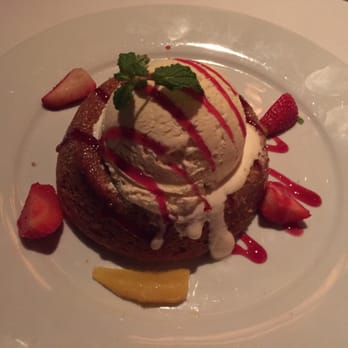
I want to click on plate, so click(x=325, y=240).